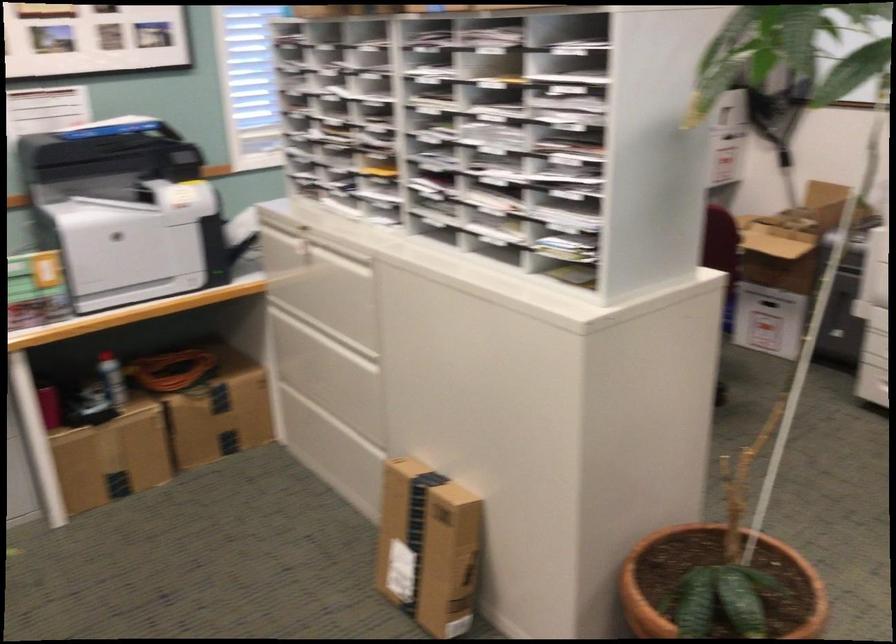
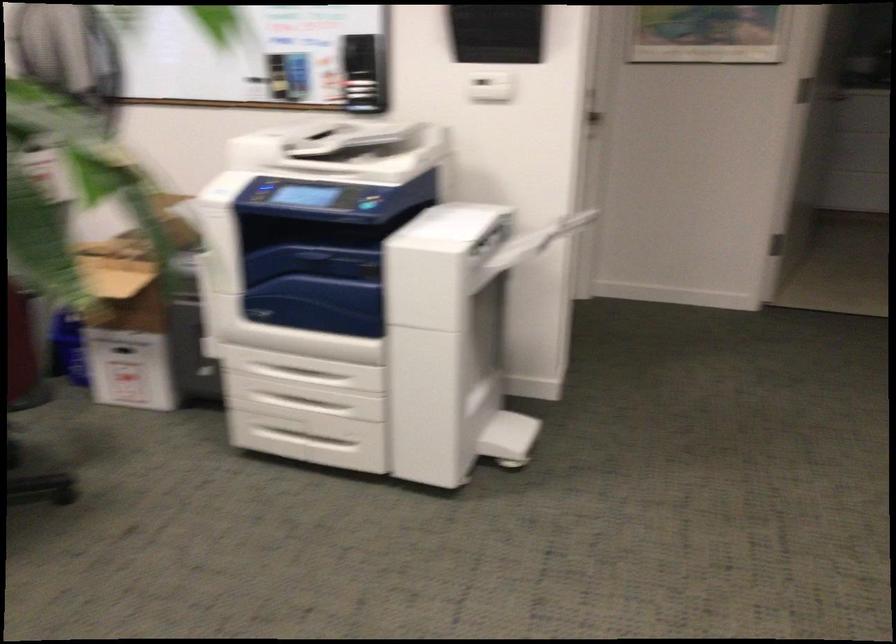
Question: Based on the continuous images, in which direction is the camera rotating? Reply with the corresponding letter.

Choices:
 (A) Left
 (B) Right
 (C) Up
 (D) Down

Answer: (B)